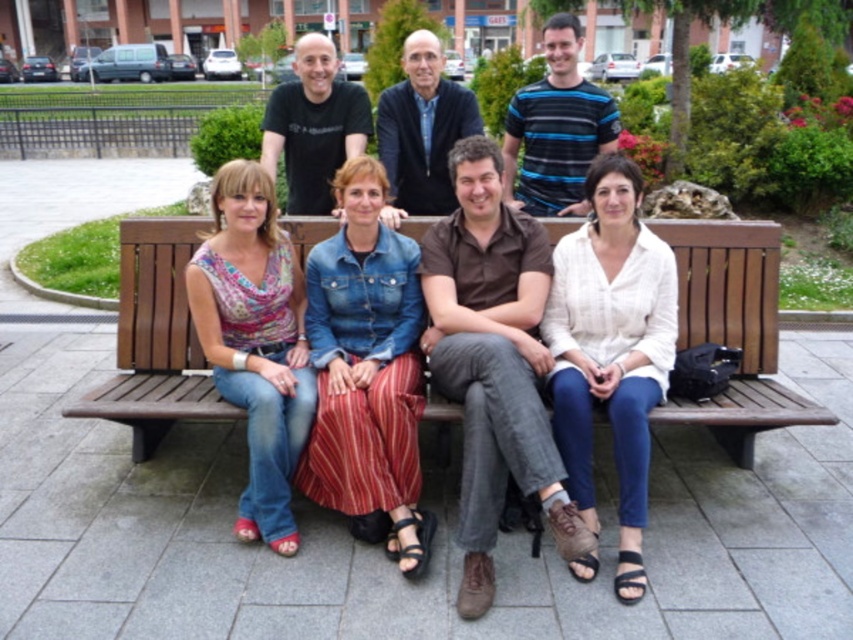
Question: Among these objects, which one is nearest to the camera?

Choices:
 (A) wooden bench at center
 (B) brown cotton shirt at center

Answer: (B)

Question: Does wooden bench at center appear under brown cotton shirt at center?

Choices:
 (A) yes
 (B) no

Answer: (B)

Question: Considering the relative positions of wooden bench at center and brown cotton shirt at center in the image provided, where is wooden bench at center located with respect to brown cotton shirt at center?

Choices:
 (A) left
 (B) right

Answer: (B)

Question: Can you confirm if denim jacket at center is positioned to the right of white striped shirt at center?

Choices:
 (A) no
 (B) yes

Answer: (A)

Question: Among these objects, which one is farthest from the camera?

Choices:
 (A) white striped shirt at center
 (B) printed cotton blouse at left
 (C) brown cotton shirt at center
 (D) wooden bench at center

Answer: (D)

Question: Which point is closer to the camera?

Choices:
 (A) (289, 220)
 (B) (247, 221)
 (C) (608, 385)
 (D) (439, 264)

Answer: (C)